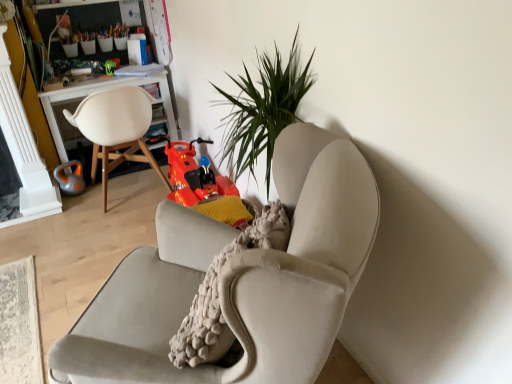
Image resolution: width=512 pixels, height=384 pixels. What do you see at coordinates (239, 279) in the screenshot?
I see `velvet beige armchair at center, the 1th chair viewed from the right` at bounding box center [239, 279].

At what (x,y) coordinates should I click in order to perform the action: click on velvet beige armchair at center, the second chair from the left. Please return your answer as a coordinate pair (x, y). This screenshot has height=384, width=512. Looking at the image, I should click on (239, 279).

Would you say orange rubber kettlebell at left, which is the second toy from top to bottom, is outside velvet beige armchair at center, the 1th chair viewed from the right?

Yes, orange rubber kettlebell at left, which is the second toy from top to bottom, is located beyond the bounds of velvet beige armchair at center, the 1th chair viewed from the right.

I want to click on the 2nd toy to the left of the velvet beige armchair at center, the 1th chair viewed from the right, counting from the anchor's position, so click(70, 178).

Looking at this image, is orange rubber kettlebell at left, acting as the 1th toy starting from the left, next to velvet beige armchair at center, the 1th chair viewed from the right?

There is a gap between orange rubber kettlebell at left, acting as the 1th toy starting from the left, and velvet beige armchair at center, the 1th chair viewed from the right.

How different are the orientations of orange rubber kettlebell at left, marked as the second toy in a right-to-left arrangement, and velvet beige armchair at center, the 1th chair viewed from the right, in degrees?

10.6 degrees separate the facing orientations of orange rubber kettlebell at left, marked as the second toy in a right-to-left arrangement, and velvet beige armchair at center, the 1th chair viewed from the right.

From a real-world perspective, relative to velvet beige armchair at center, the 1th chair viewed from the right, is white wood desk at left vertically above or below?

From a real-world perspective, white wood desk at left is physically above velvet beige armchair at center, the 1th chair viewed from the right.

Which is nearer, (46, 32) or (294, 129)?

The point (294, 129) is more forward.

Which object is thinner, white wood desk at left or velvet beige armchair at center, the second chair from the left?

white wood desk at left.

Can you confirm if white wood desk at left is positioned to the right of velvet beige armchair at center, the second chair from the left?

No, white wood desk at left is not to the right of velvet beige armchair at center, the second chair from the left.

Is orange rubber kettlebell at left, marked as the second toy in a right-to-left arrangement, inside the boundaries of white matte chair at left, which is counted as the 1th chair, starting from the left, or outside?

orange rubber kettlebell at left, marked as the second toy in a right-to-left arrangement, is not inside white matte chair at left, which is counted as the 1th chair, starting from the left, it's outside.

Is orange rubber kettlebell at left, acting as the 1th toy starting from the left, not close to white matte chair at left, which is counted as the 1th chair, starting from the left?

No, orange rubber kettlebell at left, acting as the 1th toy starting from the left, is not far from white matte chair at left, which is counted as the 1th chair, starting from the left.

From the image's perspective, is orange rubber kettlebell at left, the first toy positioned from the bottom, above or below white matte chair at left, which is counted as the 1th chair, starting from the left?

Clearly, from the image's perspective, orange rubber kettlebell at left, the first toy positioned from the bottom, is below white matte chair at left, which is counted as the 1th chair, starting from the left.

Is white wood desk at left inside or outside of white matte chair at left, which is counted as the 1th chair, starting from the left?

white wood desk at left lies outside white matte chair at left, which is counted as the 1th chair, starting from the left.

Which is behind, white wood desk at left or white matte chair at left, which is counted as the 1th chair, starting from the left?

white wood desk at left is further from the camera.

Is white wood desk at left placed right next to white matte chair at left, which is counted as the 1th chair, starting from the left?

white wood desk at left and white matte chair at left, which is counted as the 1th chair, starting from the left, are not in contact.

Can you tell me how much white wood desk at left and white matte chair at left, which is counted as the 1th chair, starting from the left, differ in facing direction?

The angle between the facing direction of white wood desk at left and the facing direction of white matte chair at left, which is counted as the 1th chair, starting from the left, is 180 degrees.

How distant is velvet beige armchair at center, the 1th chair viewed from the right, from white wood desk at left?

velvet beige armchair at center, the 1th chair viewed from the right, is 8.00 feet from white wood desk at left.

From the image's perspective, is velvet beige armchair at center, the second chair from the left, above or below white wood desk at left?

Clearly, from the image's perspective, velvet beige armchair at center, the second chair from the left, is below white wood desk at left.

From a real-world perspective, is velvet beige armchair at center, the 1th chair viewed from the right, positioned above or below white wood desk at left?

In terms of real-world spatial position, velvet beige armchair at center, the 1th chair viewed from the right, is below white wood desk at left.

Considering the relative positions of velvet beige armchair at center, the second chair from the left, and white wood desk at left in the image provided, is velvet beige armchair at center, the second chair from the left, to the left or to the right of white wood desk at left?

Clearly, velvet beige armchair at center, the second chair from the left, is on the right of white wood desk at left in the image.

From a real-world perspective, is white matte chair at left, placed as the 2th chair when sorted from right to left, physically above velvet beige armchair at center, the second chair from the left?

Yes.

Can you confirm if white matte chair at left, placed as the 2th chair when sorted from right to left, is shorter than velvet beige armchair at center, the 1th chair viewed from the right?

Incorrect, the height of white matte chair at left, placed as the 2th chair when sorted from right to left, does not fall short of that of velvet beige armchair at center, the 1th chair viewed from the right.

Looking at this image, is white matte chair at left, placed as the 2th chair when sorted from right to left, oriented towards velvet beige armchair at center, the 1th chair viewed from the right?

No, white matte chair at left, placed as the 2th chair when sorted from right to left, is not aimed at velvet beige armchair at center, the 1th chair viewed from the right.

Is white matte chair at left, which is counted as the 1th chair, starting from the left, next to velvet beige armchair at center, the 1th chair viewed from the right?

They are not placed beside each other.

Does velvet beige armchair at center, the second chair from the left, appear on the right side of orange rubber kettlebell at left, marked as the second toy in a right-to-left arrangement?

Indeed, velvet beige armchair at center, the second chair from the left, is positioned on the right side of orange rubber kettlebell at left, marked as the second toy in a right-to-left arrangement.

Does velvet beige armchair at center, the 1th chair viewed from the right, turn towards orange rubber kettlebell at left, the first toy positioned from the bottom?

No, velvet beige armchair at center, the 1th chair viewed from the right, is not facing towards orange rubber kettlebell at left, the first toy positioned from the bottom.

From the image's perspective, is velvet beige armchair at center, the 1th chair viewed from the right, above or below orange rubber kettlebell at left, acting as the 1th toy starting from the left?

Based on their image positions, velvet beige armchair at center, the 1th chair viewed from the right, is located beneath orange rubber kettlebell at left, acting as the 1th toy starting from the left.

From a real-world perspective, does velvet beige armchair at center, the second chair from the left, sit lower than orange rubber kettlebell at left, the first toy positioned from the bottom?

Indeed, from a real-world perspective, velvet beige armchair at center, the second chair from the left, is positioned beneath orange rubber kettlebell at left, the first toy positioned from the bottom.

You are a GUI agent. You are given a task and a screenshot of the screen. Output one action in this format:
    pyautogui.click(x=<x>, y=<y>)
    Task: Click on the chair that is the 2nd one when counting rightward from the orange rubber kettlebell at left, marked as the second toy in a right-to-left arrangement
    Image resolution: width=512 pixels, height=384 pixels.
    Given the screenshot: What is the action you would take?
    pyautogui.click(x=239, y=279)

Find the location of a particular element. This screenshot has width=512, height=384. bookshelf that appears above the velvet beige armchair at center, the 1th chair viewed from the right (from the image's perspective) is located at coordinates (x=74, y=16).

When comparing their distances from white wood desk at left, does shiny green toy at upper left, placed as the second toy when sorted from bottom to top, or orange rubber kettlebell at left, marked as the second toy in a right-to-left arrangement, seem further?

orange rubber kettlebell at left, marked as the second toy in a right-to-left arrangement, is positioned further to the anchor white wood desk at left.

Based on their spatial positions, is velvet beige armchair at center, the 1th chair viewed from the right, or shiny green toy at upper left, which is the 2th toy in left-to-right order, further from white wood desk at left?

velvet beige armchair at center, the 1th chair viewed from the right.

Which object lies further to the anchor point white matte chair at left, placed as the 2th chair when sorted from right to left, shiny green toy at upper left, which appears as the 1th toy when viewed from the top, or orange rubber kettlebell at left, acting as the 1th toy starting from the left?

shiny green toy at upper left, which appears as the 1th toy when viewed from the top, lies further to white matte chair at left, placed as the 2th chair when sorted from right to left, than the other object.

Estimate the real-world distances between objects in this image. Which object is further from white wood desk at left, white matte chair at left, which is counted as the 1th chair, starting from the left, or velvet beige armchair at center, the 1th chair viewed from the right?

The object further to white wood desk at left is velvet beige armchair at center, the 1th chair viewed from the right.

When comparing their distances from orange rubber kettlebell at left, the first toy positioned from the bottom, does white wood desk at left or shiny green toy at upper left, which is the 2th toy in left-to-right order, seem further?

white wood desk at left.

Looking at this image, estimate the real-world distances between objects in this image. Which object is closer to velvet beige armchair at center, the 1th chair viewed from the right, orange rubber kettlebell at left, the first toy positioned from the bottom, or white wood desk at left?

orange rubber kettlebell at left, the first toy positioned from the bottom, is positioned closer to the anchor velvet beige armchair at center, the 1th chair viewed from the right.

Estimate the real-world distances between objects in this image. Which object is closer to white matte chair at left, which is counted as the 1th chair, starting from the left, orange rubber kettlebell at left, acting as the 1th toy starting from the left, or velvet beige armchair at center, the 1th chair viewed from the right?

orange rubber kettlebell at left, acting as the 1th toy starting from the left, is closer to white matte chair at left, which is counted as the 1th chair, starting from the left.

Looking at the image, which one is located closer to white wood desk at left, velvet beige armchair at center, the 1th chair viewed from the right, or white matte chair at left, which is counted as the 1th chair, starting from the left?

white matte chair at left, which is counted as the 1th chair, starting from the left, is closer to white wood desk at left.

Find the location of a particular element. chair between velvet beige armchair at center, the second chair from the left, and orange rubber kettlebell at left, marked as the second toy in a right-to-left arrangement, along the z-axis is located at coordinates (x=116, y=129).

I want to click on bookshelf between white matte chair at left, which is counted as the 1th chair, starting from the left, and shiny green toy at upper left, the first toy when ordered from right to left, along the z-axis, so click(74, 16).

This screenshot has width=512, height=384. In order to click on chair between velvet beige armchair at center, the 1th chair viewed from the right, and white wood desk at left from front to back in this screenshot , I will do `click(116, 129)`.

Where is `bookshelf located between white matte chair at left, which is counted as the 1th chair, starting from the left, and orange rubber kettlebell at left, acting as the 1th toy starting from the left, in the depth direction`? This screenshot has width=512, height=384. bookshelf located between white matte chair at left, which is counted as the 1th chair, starting from the left, and orange rubber kettlebell at left, acting as the 1th toy starting from the left, in the depth direction is located at coordinates (74, 16).